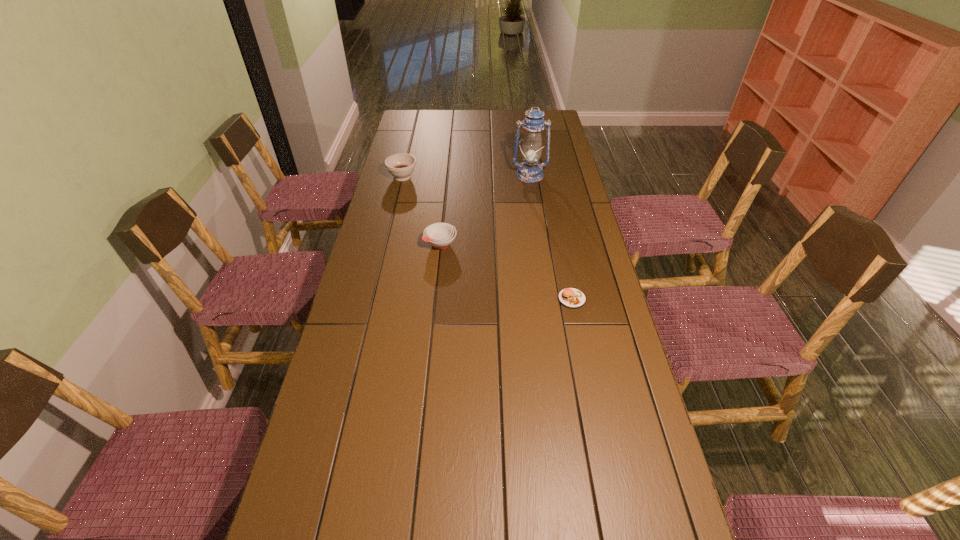
Locate an element on the screen. free point that satisfies the following two spatial constraints: 1. on the front-facing side of the tallest object; 2. on the left side of the nearest object is located at coordinates (548, 299).

The width and height of the screenshot is (960, 540). I want to click on vacant position in the image that satisfies the following two spatial constraints: 1. on the front-facing side of the shortest object; 2. on the right side of the tallest object, so click(x=548, y=299).